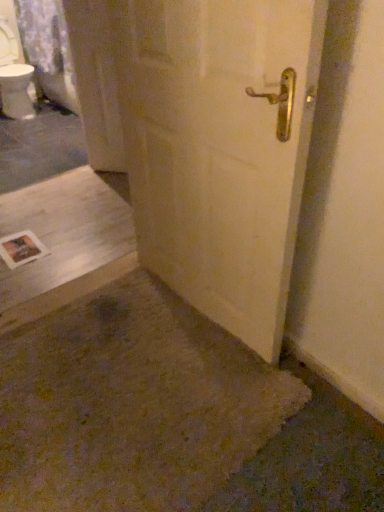
Question: From a real-world perspective, is white concrete at lower left beneath white matte door at center?

Choices:
 (A) no
 (B) yes

Answer: (B)

Question: Does white concrete at lower left lie in front of white matte door at center?

Choices:
 (A) no
 (B) yes

Answer: (A)

Question: Does white concrete at lower left turn towards white matte door at center?

Choices:
 (A) yes
 (B) no

Answer: (B)

Question: Is white matte door at center a part of white concrete at lower left?

Choices:
 (A) yes
 (B) no

Answer: (B)

Question: From the image's perspective, would you say white concrete at lower left is shown under white matte door at center?

Choices:
 (A) no
 (B) yes

Answer: (B)

Question: From a real-world perspective, is white concrete at lower left located higher than white matte door at center?

Choices:
 (A) yes
 (B) no

Answer: (B)

Question: Considering the relative sizes of white matte door at center and white concrete at lower left in the image provided, is white matte door at center shorter than white concrete at lower left?

Choices:
 (A) yes
 (B) no

Answer: (B)

Question: Is white matte door at center far from white concrete at lower left?

Choices:
 (A) no
 (B) yes

Answer: (A)

Question: Is white matte door at center smaller than white concrete at lower left?

Choices:
 (A) no
 (B) yes

Answer: (A)

Question: Is the depth of white matte door at center greater than that of white concrete at lower left?

Choices:
 (A) yes
 (B) no

Answer: (B)

Question: From a real-world perspective, does white matte door at center sit lower than white concrete at lower left?

Choices:
 (A) yes
 (B) no

Answer: (B)

Question: Is white matte door at center placed right next to white concrete at lower left?

Choices:
 (A) yes
 (B) no

Answer: (B)

Question: Would you say white matte door at center is inside or outside white concrete at lower left?

Choices:
 (A) inside
 (B) outside

Answer: (B)